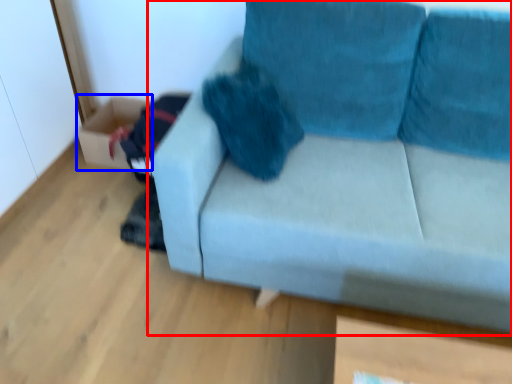
Question: Which of the following is the closest to the observer, studio couch (highlighted by a red box) or box (highlighted by a blue box)?

Choices:
 (A) studio couch
 (B) box

Answer: (A)